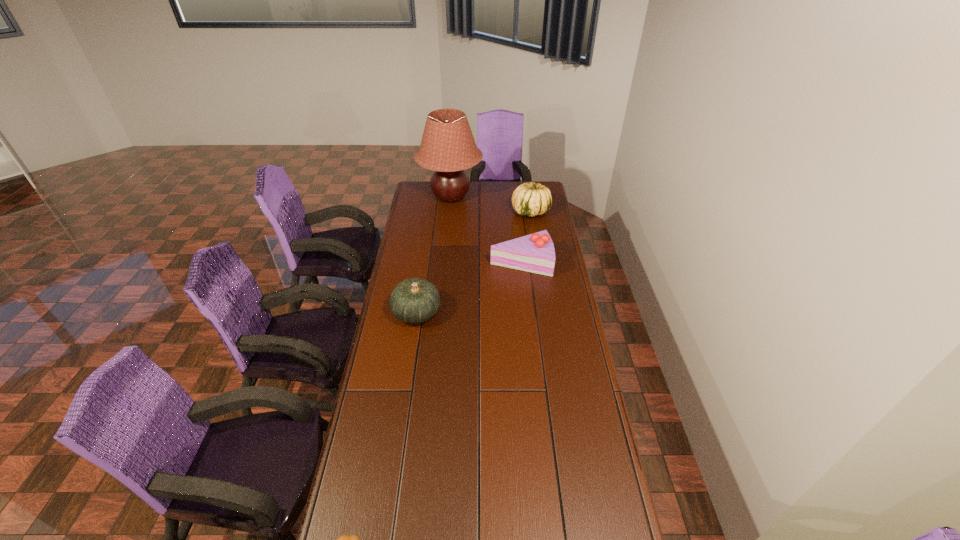
Find the location of a particular element. This screenshot has width=960, height=540. vacant space in between the second nearest object and the tallest object is located at coordinates (434, 254).

Image resolution: width=960 pixels, height=540 pixels. Find the location of `vacant region between the farthest gourd and the fourth farthest object`. vacant region between the farthest gourd and the fourth farthest object is located at coordinates (x=473, y=262).

Identify which object is the third nearest to the cake. Please provide its 2D coordinates. Your answer should be formatted as a tuple, i.e. [(x, y)], where the tuple contains the x and y coordinates of a point satisfying the conditions above.

[(448, 147)]

At what (x,y) coordinates should I click in order to perform the action: click on object that is the fourth closest to the second nearest gourd. Please return your answer as a coordinate pair (x, y). Image resolution: width=960 pixels, height=540 pixels. Looking at the image, I should click on (344, 539).

Identify which gourd is the second closest to the fourth farthest object. Please provide its 2D coordinates. Your answer should be formatted as a tuple, i.e. [(x, y)], where the tuple contains the x and y coordinates of a point satisfying the conditions above.

[(344, 539)]

This screenshot has width=960, height=540. In order to click on gourd that stands as the closest to the rightmost gourd in this screenshot , I will do `click(415, 300)`.

Where is `free space in the image that satisfies the following two spatial constraints: 1. on the back side of the rightmost gourd; 2. on the right side of the cake`? The width and height of the screenshot is (960, 540). free space in the image that satisfies the following two spatial constraints: 1. on the back side of the rightmost gourd; 2. on the right side of the cake is located at coordinates (516, 212).

Locate an element on the screen. vacant space that satisfies the following two spatial constraints: 1. on the front-facing side of the third nearest object; 2. on the right side of the lampshade is located at coordinates (444, 262).

Locate an element on the screen. The image size is (960, 540). free space that satisfies the following two spatial constraints: 1. on the front-facing side of the lampshade; 2. on the front side of the second nearest object is located at coordinates (440, 313).